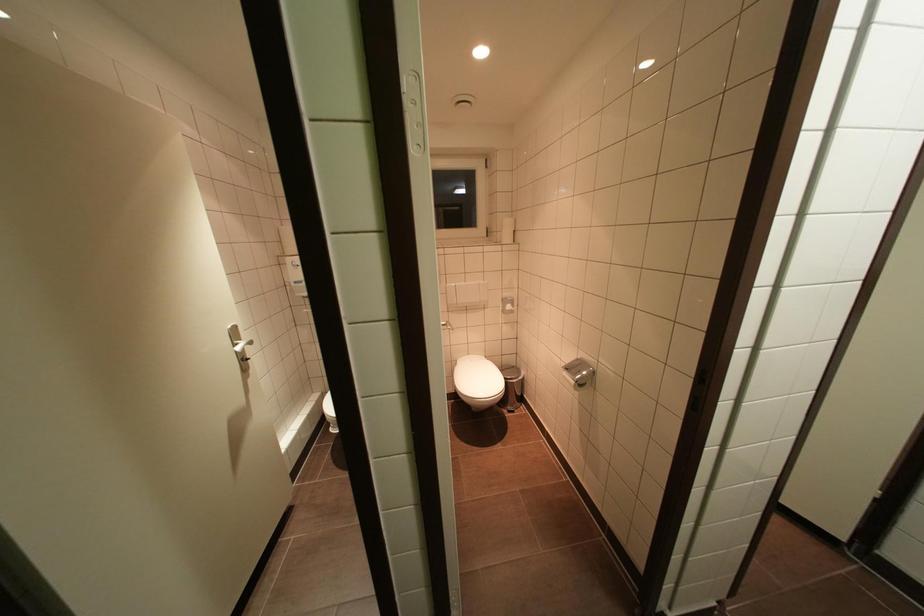
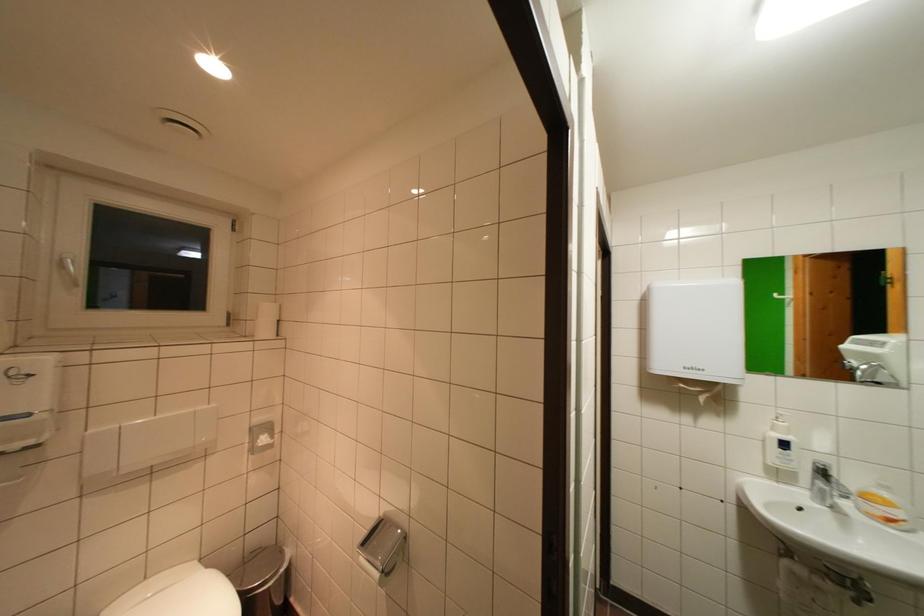
Where in the second image is the point corresponding to the point at 526,374 from the first image?

(286, 554)